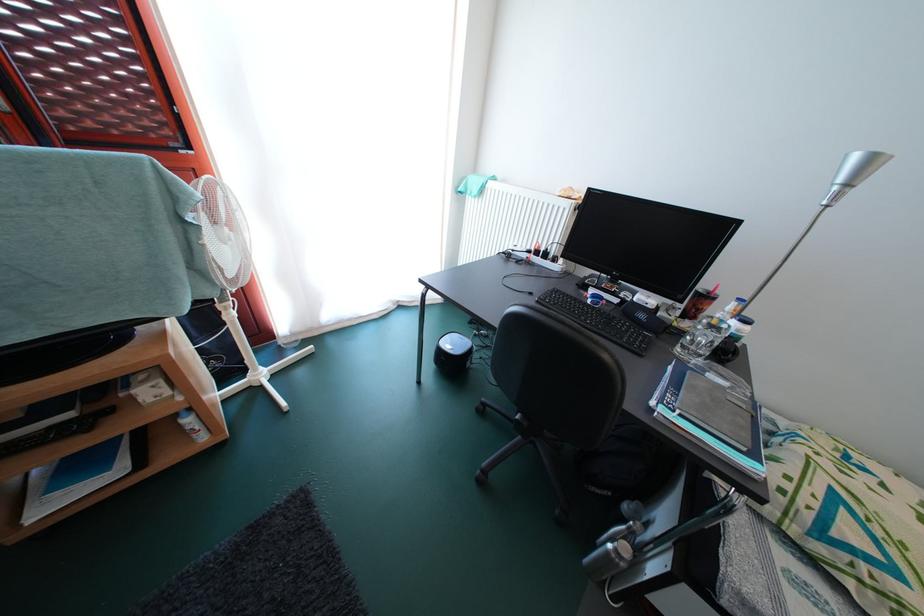
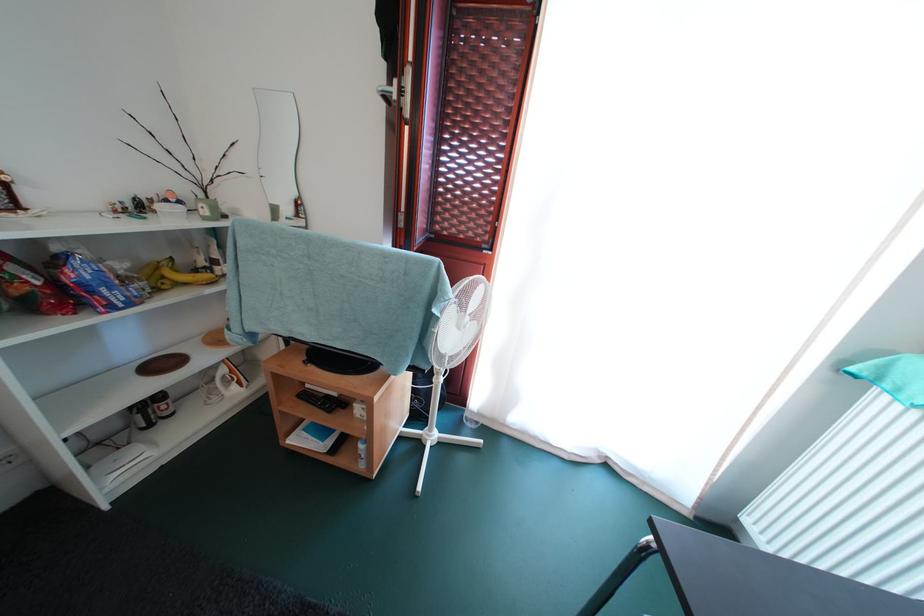
Locate, in the second image, the point that corresponds to the point at 431,299 in the first image.

(655, 551)